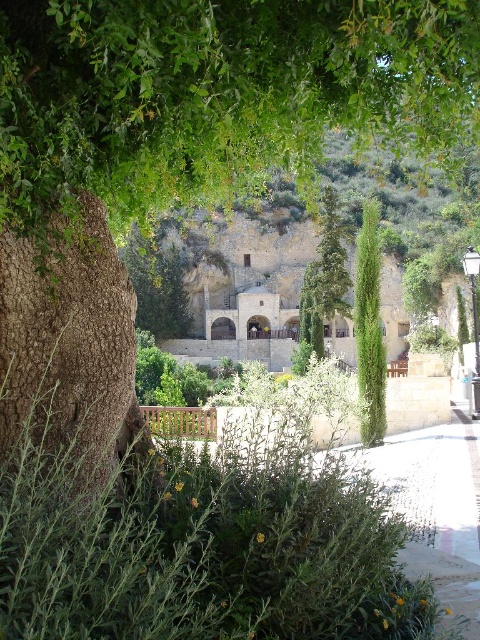
You are a gardener who needs to place a new decorative item between the brown wooden bench at lower center and the green textured cypress at center. Considering their widths, which object should you place the item closer to to ensure it fits better?

The brown wooden bench at lower center is wider than the green textured cypress at center. Therefore, placing the decorative item closer to the green textured cypress at center would provide more space for the item to fit comfortably between them.

You are planning to sit on the brown wooden bench at lower center to take a photo of the green textured cypress at center. Will the bench block your view of the tree?

The brown wooden bench at lower center is below the green textured cypress at center, so sitting on the bench would not block your view of the tree.